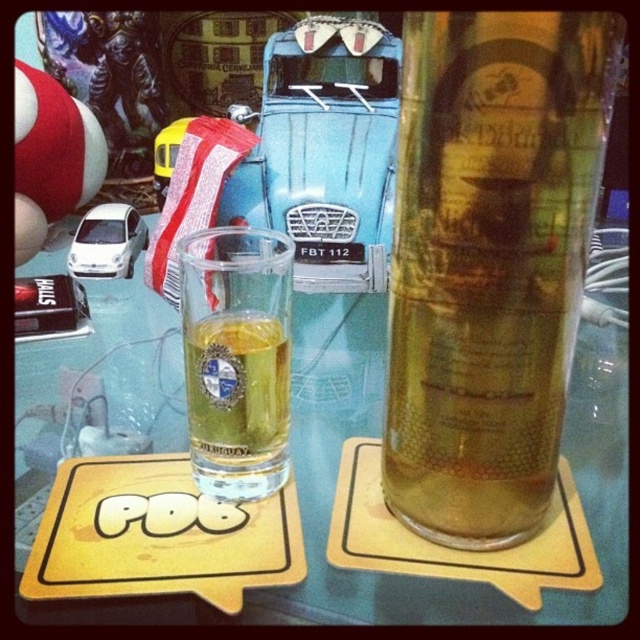
Question: Which point is closer to the camera?

Choices:
 (A) translucent glass beer at center
 (B) clear glass shot glass at center

Answer: (A)

Question: Does translucent glass beer at center have a smaller size compared to clear glass shot glass at center?

Choices:
 (A) no
 (B) yes

Answer: (A)

Question: Which point is closer to the camera?

Choices:
 (A) (227, 260)
 (B) (492, 432)

Answer: (B)

Question: Can you confirm if translucent glass beer at center is positioned to the left of clear glass shot glass at center?

Choices:
 (A) no
 (B) yes

Answer: (A)

Question: Which of the following is the closest to the observer?

Choices:
 (A) translucent glass beer at center
 (B) clear glass shot glass at center

Answer: (A)

Question: Considering the relative positions of translucent glass beer at center and clear glass shot glass at center in the image provided, where is translucent glass beer at center located with respect to clear glass shot glass at center?

Choices:
 (A) below
 (B) above

Answer: (B)